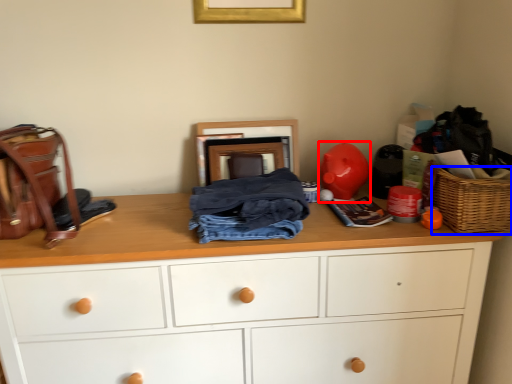
Question: Which object is closer to the camera taking this photo, toy (highlighted by a red box) or picnic basket (highlighted by a blue box)?

Choices:
 (A) toy
 (B) picnic basket

Answer: (B)